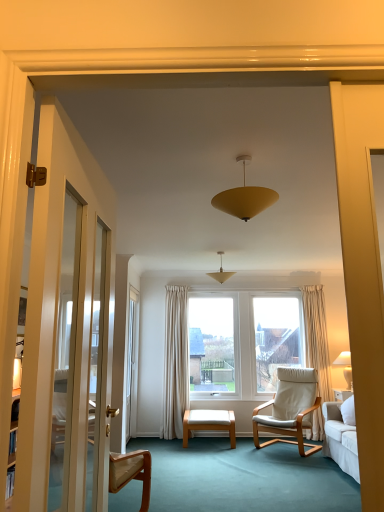
Question: In terms of width, does matte yellow cone at center look wider or thinner when compared to matte yellow cone at center?

Choices:
 (A) thin
 (B) wide

Answer: (B)

Question: In the image, is matte yellow cone at center positioned in front of or behind matte yellow cone at center?

Choices:
 (A) behind
 (B) front

Answer: (B)

Question: Which object is positioned farthest from the matte yellow cone at center?

Choices:
 (A) white glossy screen door at left
 (B) white fabric chair at center
 (C) matte yellow cone at center
 (D) white wood stool at center

Answer: (A)

Question: Which is farther from the matte yellow cone at center?

Choices:
 (A) white fabric chair at center
 (B) matte yellow cone at center
 (C) white glossy screen door at left
 (D) white wood stool at center

Answer: (C)